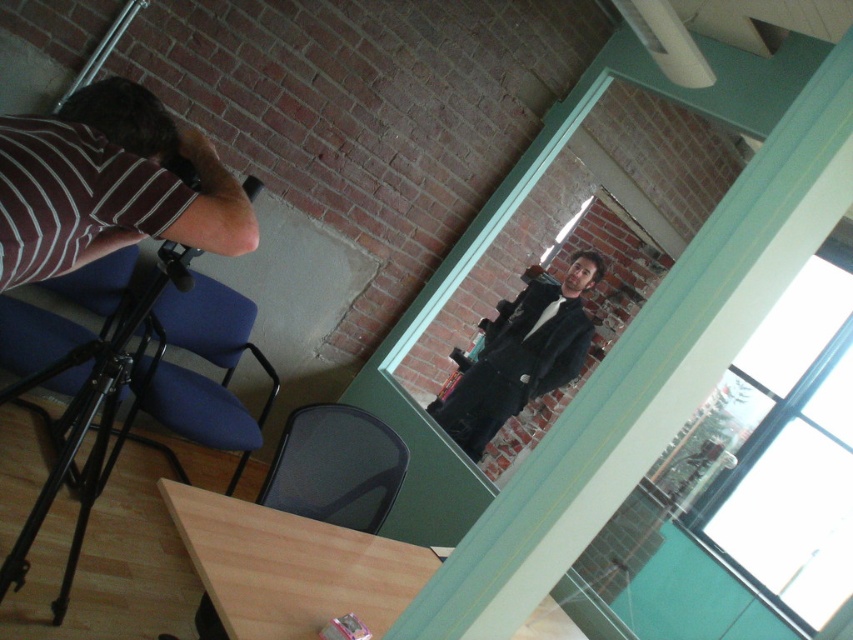
You are organizing a photoshoot and need to ensure that the striped fabric shirt at left and the black matte jacket at center can fit side by side on a 1.2 meter wide display. Based on their sizes, will they both fit?

The striped fabric shirt at left is narrower than the black matte jacket at center. To determine if they fit together, we need to know the combined width of both items. However, since the striped fabric shirt at left is less wide than the black matte jacket at center, and the total width required would depend on their individual measurements. Without exact dimensions, it is uncertain if their combined width exceeds 1.2 meters. More information is needed.